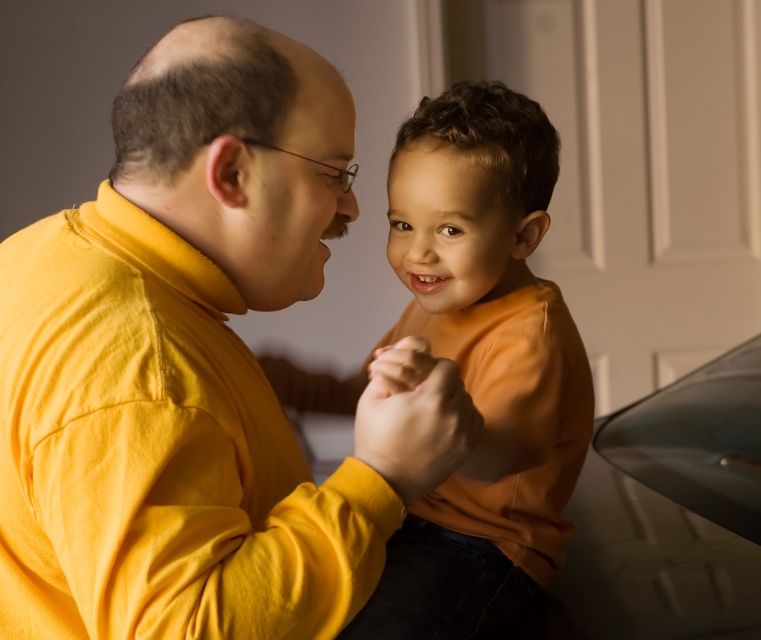
You are an artist trying to paint this scene. You need to place the yellow matte shirt at center and orange matte shirt at center correctly. Based on the description, which shirt should be placed higher in your painting?

The yellow matte shirt at center should be placed higher in the painting because it is positioned over the orange matte shirt at center according to the description.